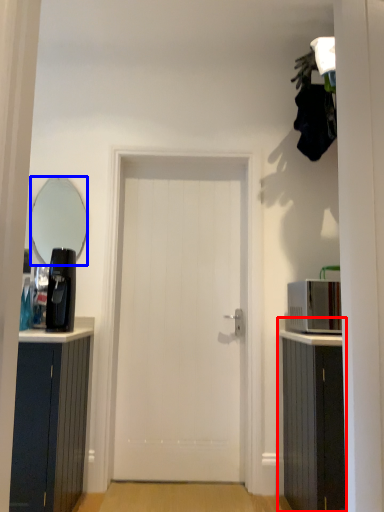
Question: Which object appears farthest to the camera in this image, cabinetry (highlighted by a red box) or mirror (highlighted by a blue box)?

Choices:
 (A) cabinetry
 (B) mirror

Answer: (B)